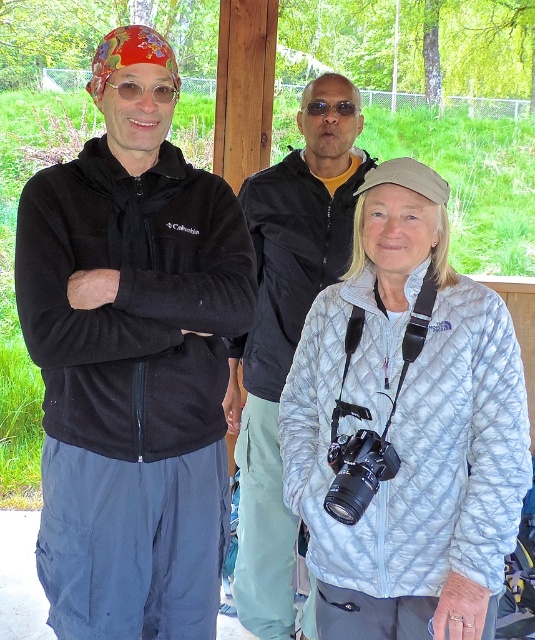
Is point (453, 416) positioned after point (256, 243)?

No, (453, 416) is closer to viewer.

Is light blue quilted jacket at center further to the viewer compared to matte black jacket at center?

That is False.

Is point (356, 589) positioned behind point (263, 500)?

No, it is not.

Identify the location of light blue quilted jacket at center. The image size is (535, 640). (406, 428).

Which is above, matte black hoodie at left or matte black jacket at center?

matte black hoodie at left is above.

Is point (135, 614) positioned after point (278, 196)?

No, (135, 614) is in front of (278, 196).

Where is `matte black hoodie at left`? matte black hoodie at left is located at coordinates (132, 358).

Does matte black hoodie at left appear under light blue quilted jacket at center?

No, matte black hoodie at left is not below light blue quilted jacket at center.

How far apart are matte black hoodie at left and light blue quilted jacket at center?

40.80 centimeters

Who is more distant from viewer, (179, 454) or (412, 552)?

The point (179, 454) is more distant.

I want to click on matte black hoodie at left, so click(x=132, y=358).